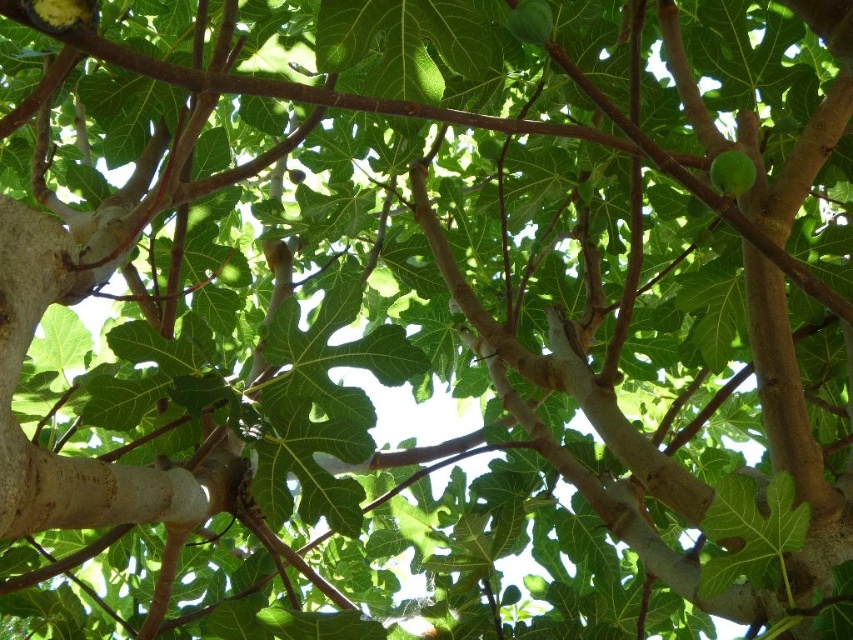
Can you confirm if yellowish-green smooth fig at upper left is thinner than green matte fig at upper center?

Correct, yellowish-green smooth fig at upper left's width is less than green matte fig at upper center's.

Describe the element at coordinates (62, 13) in the screenshot. I see `yellowish-green smooth fig at upper left` at that location.

Where is `yellowish-green smooth fig at upper left`? yellowish-green smooth fig at upper left is located at coordinates (62, 13).

Who is higher up, green matte fig at upper right or green matte fig at upper center?

green matte fig at upper center is above.

Is green matte fig at upper right behind green matte fig at upper center?

Yes.

This screenshot has height=640, width=853. Describe the element at coordinates (732, 172) in the screenshot. I see `green matte fig at upper right` at that location.

This screenshot has width=853, height=640. Identify the location of green matte fig at upper right. (732, 172).

From the picture: Who is more distant from viewer, (38, 22) or (749, 170)?

Positioned behind is point (749, 170).

Where is `yellowish-green smooth fig at upper left`? Image resolution: width=853 pixels, height=640 pixels. yellowish-green smooth fig at upper left is located at coordinates (62, 13).

Image resolution: width=853 pixels, height=640 pixels. In order to click on yellowish-green smooth fig at upper left in this screenshot , I will do `click(62, 13)`.